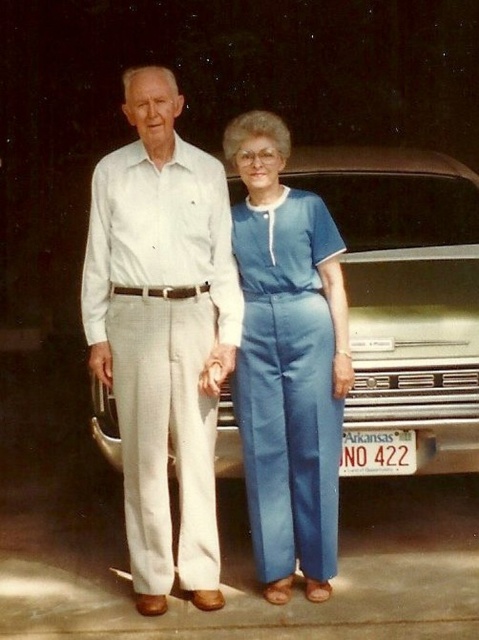
Who is positioned more to the right, metallic silver car at center or blue cotton jumpsuit at center?

From the viewer's perspective, metallic silver car at center appears more on the right side.

Who is higher up, metallic silver car at center or blue cotton jumpsuit at center?

metallic silver car at center is above.

Where is `metallic silver car at center`? This screenshot has width=479, height=640. metallic silver car at center is located at coordinates (407, 291).

This screenshot has width=479, height=640. In order to click on metallic silver car at center in this screenshot , I will do `click(407, 291)`.

Does blue cotton jumpsuit at center have a larger size compared to white plastic arkansas license plate at center?

Indeed, blue cotton jumpsuit at center has a larger size compared to white plastic arkansas license plate at center.

In the scene shown: Who is taller, blue cotton jumpsuit at center or white plastic arkansas license plate at center?

Standing taller between the two is blue cotton jumpsuit at center.

Is point (333, 282) farther from camera compared to point (358, 445)?

No, (333, 282) is closer to viewer.

Find the location of a particular element. Image resolution: width=479 pixels, height=640 pixels. blue cotton jumpsuit at center is located at coordinates (287, 362).

Is point (152, 492) closer to viewer compared to point (403, 468)?

Yes, it is.

From the picture: Is white cotton pants at center to the right of white plastic arkansas license plate at center from the viewer's perspective?

No, white cotton pants at center is not to the right of white plastic arkansas license plate at center.

Is point (209, 376) more distant than point (373, 445)?

No, (209, 376) is in front of (373, 445).

I want to click on white cotton pants at center, so click(162, 332).